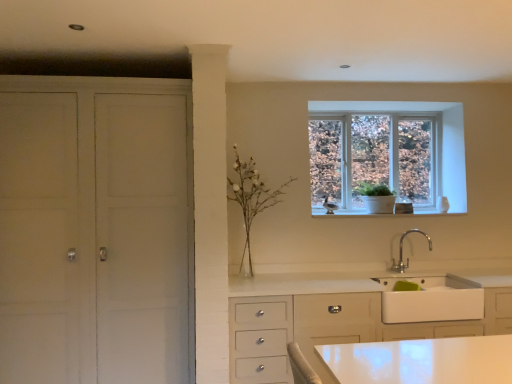
Question: In the image, is chrome metallic faucet at lower right on the left side or the right side of white matte sink at lower right?

Choices:
 (A) right
 (B) left

Answer: (B)

Question: Is point (400, 236) positioned closer to the camera than point (418, 296)?

Choices:
 (A) farther
 (B) closer

Answer: (A)

Question: Which is farther from the white matte sink at lower right?

Choices:
 (A) white glass vase at center
 (B) clear glass window at upper center
 (C) chrome metallic faucet at lower right
 (D) white matte cabinet at left

Answer: (D)

Question: Estimate the real-world distances between objects in this image. Which object is farther from the white glass vase at center?

Choices:
 (A) white matte sink at lower right
 (B) white matte cabinet at left
 (C) clear glass window at upper center
 (D) chrome metallic faucet at lower right

Answer: (A)